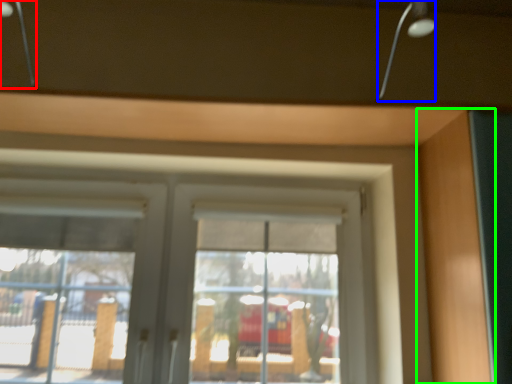
Question: Considering the real-world distances, which object is closest to lamp (highlighted by a red box)? lamp (highlighted by a blue box) or garage door (highlighted by a green box).

Choices:
 (A) lamp
 (B) garage door

Answer: (A)